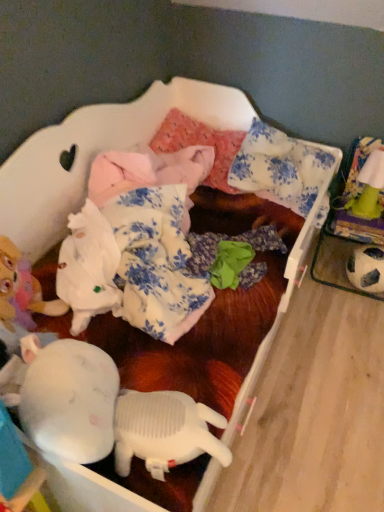
Question: From a real-world perspective, is green fabric toy at upper right, arranged as the 1th toy when viewed from the top, under black and white textured soccer ball at right, positioned as the second toy in top-to-bottom order?

Choices:
 (A) no
 (B) yes

Answer: (A)

Question: Is black and white textured soccer ball at right, positioned as the second toy in top-to-bottom order, inside green fabric toy at upper right, arranged as the 1th toy when viewed from the top?

Choices:
 (A) yes
 (B) no

Answer: (B)

Question: Is green fabric toy at upper right, which is the second toy from bottom to top, far away from black and white textured soccer ball at right, which ranks as the 1th toy in bottom-to-top order?

Choices:
 (A) no
 (B) yes

Answer: (A)

Question: Is green fabric toy at upper right, which is the second toy from bottom to top, smaller than black and white textured soccer ball at right, which ranks as the 1th toy in bottom-to-top order?

Choices:
 (A) yes
 (B) no

Answer: (A)

Question: Can you confirm if green fabric toy at upper right, which is the second toy from bottom to top, is taller than black and white textured soccer ball at right, which ranks as the 1th toy in bottom-to-top order?

Choices:
 (A) no
 (B) yes

Answer: (B)

Question: Is black and white textured soccer ball at right, positioned as the second toy in top-to-bottom order, to the left or to the right of white floral fabric pillow at upper center, acting as the first pillow starting from the right, in the image?

Choices:
 (A) left
 (B) right

Answer: (B)

Question: Is point (345, 269) closer or farther from the camera than point (264, 131)?

Choices:
 (A) farther
 (B) closer

Answer: (A)

Question: Do you think black and white textured soccer ball at right, positioned as the second toy in top-to-bottom order, is within white floral fabric pillow at upper center, acting as the first pillow starting from the right, or outside of it?

Choices:
 (A) inside
 (B) outside

Answer: (B)

Question: Looking at their shapes, would you say black and white textured soccer ball at right, positioned as the second toy in top-to-bottom order, is wider or thinner than white floral fabric pillow at upper center, arranged as the second pillow when viewed from the left?

Choices:
 (A) wide
 (B) thin

Answer: (B)

Question: Is point (309, 183) positioned closer to the camera than point (216, 188)?

Choices:
 (A) farther
 (B) closer

Answer: (B)

Question: Would you say white floral fabric pillow at upper center, arranged as the second pillow when viewed from the left, is to the left or to the right of pink fabric pillow at center, placed as the second pillow when sorted from right to left, in the picture?

Choices:
 (A) left
 (B) right

Answer: (B)

Question: From the image's perspective, is white floral fabric pillow at upper center, arranged as the second pillow when viewed from the left, located above or below pink fabric pillow at center, the 1th pillow viewed from the left?

Choices:
 (A) above
 (B) below

Answer: (B)

Question: Considering their positions, is white floral fabric pillow at upper center, arranged as the second pillow when viewed from the left, located in front of or behind pink fabric pillow at center, the 1th pillow viewed from the left?

Choices:
 (A) front
 (B) behind

Answer: (A)

Question: Considering the positions of point (190, 117) and point (377, 200), is point (190, 117) closer or farther from the camera than point (377, 200)?

Choices:
 (A) closer
 (B) farther

Answer: (B)

Question: Relative to green fabric toy at upper right, arranged as the 1th toy when viewed from the top, is pink fabric pillow at center, placed as the second pillow when sorted from right to left, in front or behind?

Choices:
 (A) behind
 (B) front

Answer: (A)